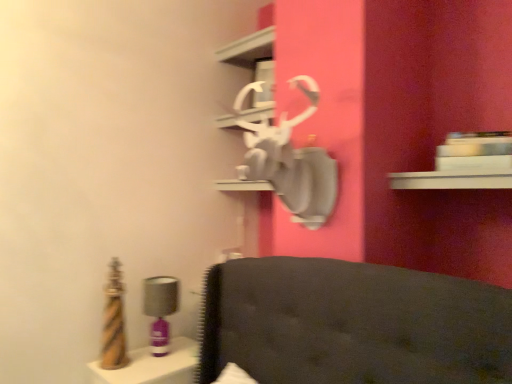
The width and height of the screenshot is (512, 384). Identify the location of vacant space in matte purple table lamp at left (from a real-world perspective). (158, 347).